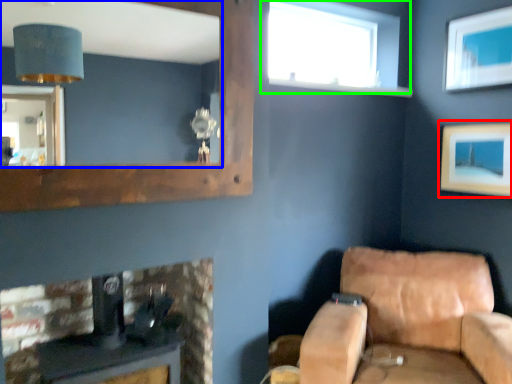
Question: Which object is the farthest from picture frame (highlighted by a red box)? Choose among these: mirror (highlighted by a blue box) or window (highlighted by a green box).

Choices:
 (A) mirror
 (B) window

Answer: (A)